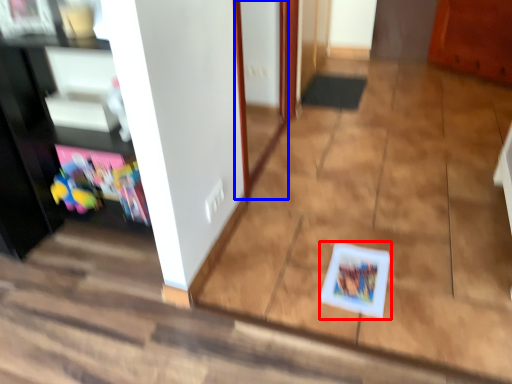
Question: Which object is further to the camera taking this photo, card game (highlighted by a red box) or door (highlighted by a blue box)?

Choices:
 (A) card game
 (B) door

Answer: (A)